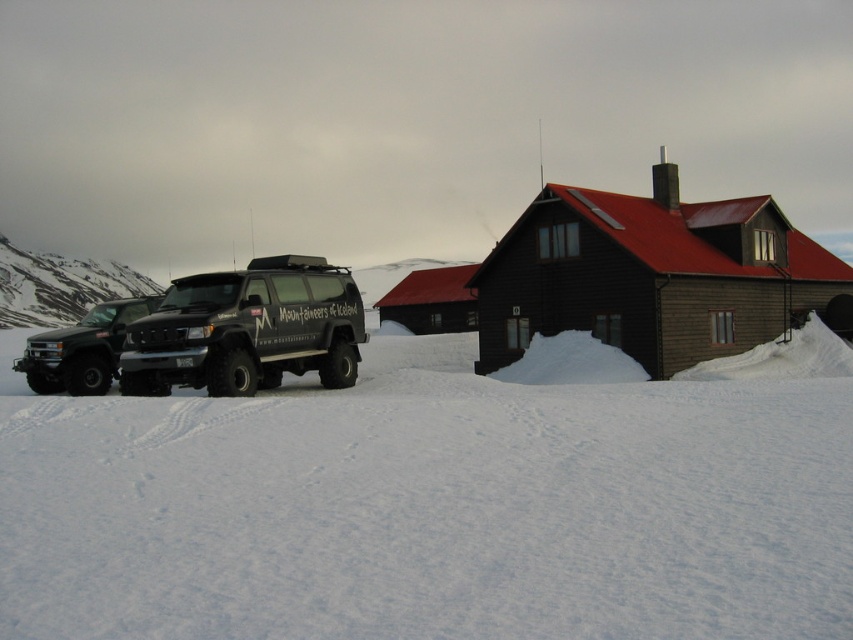
Which of these two, white powdery snow at center or matte black truck at left, stands shorter?

Standing shorter between the two is white powdery snow at center.

Is the position of white powdery snow at center less distant than that of matte black truck at left?

Yes, white powdery snow at center is closer to the viewer.

The image size is (853, 640). I want to click on white powdery snow at center, so click(437, 500).

Between point (158, 348) and point (49, 372), which one is positioned in front?

Point (158, 348)

Is point (160, 339) farther from viewer compared to point (49, 380)?

No, it is not.

I want to click on matte black van at center, so click(247, 330).

Can you confirm if white powdery snow at center is positioned to the right of matte black van at center?

Incorrect, white powdery snow at center is not on the right side of matte black van at center.

Does white powdery snow at center appear on the left side of matte black van at center?

Correct, you'll find white powdery snow at center to the left of matte black van at center.

Is point (715, 404) positioned behind point (212, 349)?

No, (715, 404) is in front of (212, 349).

What are the coordinates of `white powdery snow at center` in the screenshot? It's located at (437, 500).